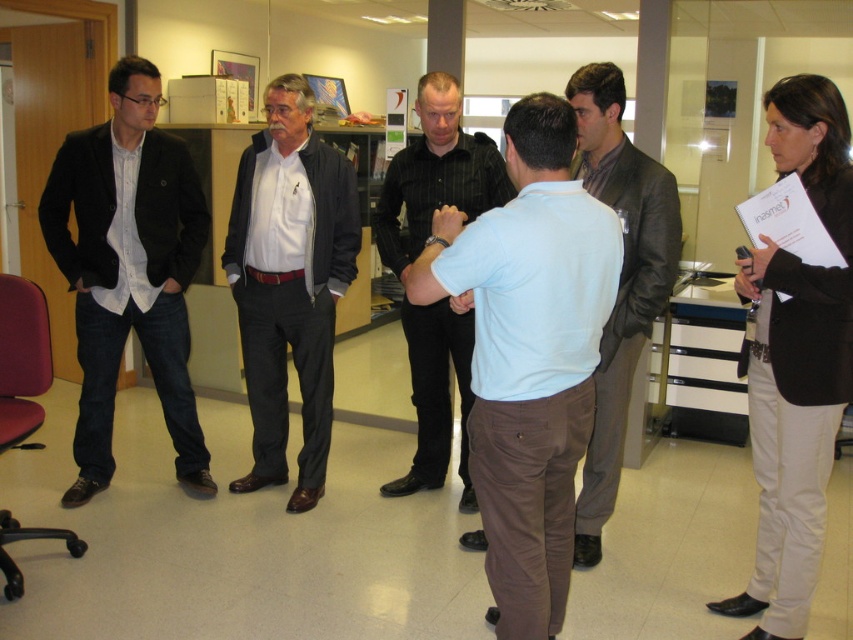
You are standing in the office scene described. There is a point at coordinate [289,282]. What object or person is located at that point?

The white matte shirt at center is located at point [289,282].

You are an office assistant who needs to locate the dark blue denim jeans at left and the dark brown leather jacket at center for a client. According to the scene, which object is positioned to the left of the other?

The dark blue denim jeans at left is to the left of the dark brown leather jacket at center.